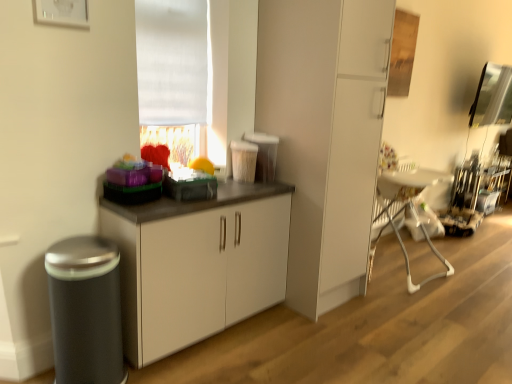
What do you see at coordinates (174, 76) in the screenshot? I see `white fabric window at upper center` at bounding box center [174, 76].

The height and width of the screenshot is (384, 512). In order to click on white plastic swivel chair at right in this screenshot , I will do `click(409, 209)`.

What do you see at coordinates (189, 185) in the screenshot? I see `matte black toaster at center, placed as the 2th appliance when sorted from front to back` at bounding box center [189, 185].

Describe the element at coordinates (464, 200) in the screenshot. I see `metallic stainless steel coffee machine at right, positioned as the 1th appliance in right-to-left order` at that location.

At what (x,y) coordinates should I click in order to perform the action: click on white fabric window at upper center. Please return your answer as a coordinate pair (x, y). Looking at the image, I should click on (174, 76).

Is white matte cabinet at center, which appears as the second cabinetry when viewed from the left, not inside transparent glass window screen at upper right?

Indeed, white matte cabinet at center, which appears as the second cabinetry when viewed from the left, is completely outside transparent glass window screen at upper right.

Is white matte cabinet at center, marked as the 1th cabinetry in a right-to-left arrangement, directly adjacent to transparent glass window screen at upper right?

No, white matte cabinet at center, marked as the 1th cabinetry in a right-to-left arrangement, is not touching transparent glass window screen at upper right.

What's the angular difference between white matte cabinet at center, marked as the 1th cabinetry in a right-to-left arrangement, and transparent glass window screen at upper right's facing directions?

white matte cabinet at center, marked as the 1th cabinetry in a right-to-left arrangement, and transparent glass window screen at upper right are facing 0.545 degrees away from each other.

Image resolution: width=512 pixels, height=384 pixels. I want to click on the 1st cabinetry in front of the transparent glass window screen at upper right, counting from the anchor's position, so point(325,135).

Consider the image. Based on their sizes in the image, would you say white matte cabinet at center, marked as the 1th cabinetry in a right-to-left arrangement, is bigger or smaller than white matte cabinet at center, which is the 1th cabinetry in left-to-right order?

white matte cabinet at center, marked as the 1th cabinetry in a right-to-left arrangement, is bigger than white matte cabinet at center, which is the 1th cabinetry in left-to-right order.

Does white matte cabinet at center, marked as the 1th cabinetry in a right-to-left arrangement, lie in front of white matte cabinet at center, which is the 1th cabinetry in left-to-right order?

No, the depth of white matte cabinet at center, marked as the 1th cabinetry in a right-to-left arrangement, is greater than that of white matte cabinet at center, which is the 1th cabinetry in left-to-right order.

Can you confirm if white matte cabinet at center, marked as the 1th cabinetry in a right-to-left arrangement, is taller than white matte cabinet at center, which is the 1th cabinetry in left-to-right order?

Correct, white matte cabinet at center, marked as the 1th cabinetry in a right-to-left arrangement, is much taller as white matte cabinet at center, which is the 1th cabinetry in left-to-right order.

Are white matte cabinet at center, which appears as the second cabinetry when viewed from the left, and white matte cabinet at center, which is the 2th cabinetry in right-to-left order, making contact?

They are not placed beside each other.

Can you tell me how much white fabric window at upper center and white plastic swivel chair at right differ in facing direction?

0.185 degrees separate the facing orientations of white fabric window at upper center and white plastic swivel chair at right.

Between point (158, 128) and point (410, 191), which one is positioned behind?

The point (410, 191) is more distant.

Would you say white fabric window at upper center is a long distance from white plastic swivel chair at right?

Yes, white fabric window at upper center and white plastic swivel chair at right are quite far apart.

Which is in front, point (453, 212) or point (385, 198)?

The point (385, 198) is more forward.

Which object is further away from the camera taking this photo, metallic stainless steel coffee machine at right, the first appliance viewed from the back, or white plastic swivel chair at right?

metallic stainless steel coffee machine at right, the first appliance viewed from the back.

In the scene shown: Which of these two, metallic stainless steel coffee machine at right, placed as the third appliance when sorted from front to back, or white plastic swivel chair at right, stands shorter?

metallic stainless steel coffee machine at right, placed as the third appliance when sorted from front to back.

From the image's perspective, is white plastic swivel chair at right located beneath metallic stainless steel coffee machine at right, positioned as the 1th appliance in right-to-left order?

Yes, from the image's perspective, white plastic swivel chair at right is beneath metallic stainless steel coffee machine at right, positioned as the 1th appliance in right-to-left order.

From a real-world perspective, who is located lower, white plastic swivel chair at right or metallic stainless steel coffee machine at right, positioned as the 1th appliance in right-to-left order?

metallic stainless steel coffee machine at right, positioned as the 1th appliance in right-to-left order, is physically lower.

Is white plastic swivel chair at right positioned behind metallic stainless steel coffee machine at right, positioned as the 1th appliance in right-to-left order?

No, white plastic swivel chair at right is in front of metallic stainless steel coffee machine at right, positioned as the 1th appliance in right-to-left order.

Based on the photo, is white plastic swivel chair at right smaller than metallic stainless steel coffee machine at right, positioned as the 1th appliance in right-to-left order?

Actually, white plastic swivel chair at right might be larger than metallic stainless steel coffee machine at right, positioned as the 1th appliance in right-to-left order.

From a real-world perspective, is matte black toaster at center, placed as the 2th appliance when sorted from front to back, physically located above or below metallic stainless steel coffee machine at right, placed as the third appliance when sorted from front to back?

matte black toaster at center, placed as the 2th appliance when sorted from front to back, is above metallic stainless steel coffee machine at right, placed as the third appliance when sorted from front to back.

Would you say matte black toaster at center, which appears as the 2th appliance when viewed from the left, is to the left or to the right of metallic stainless steel coffee machine at right, which ranks as the third appliance in left-to-right order, in the picture?

Clearly, matte black toaster at center, which appears as the 2th appliance when viewed from the left, is on the left of metallic stainless steel coffee machine at right, which ranks as the third appliance in left-to-right order, in the image.

How far apart are matte black toaster at center, which appears as the 2th appliance when viewed from the left, and metallic stainless steel coffee machine at right, positioned as the 1th appliance in right-to-left order?

The distance of matte black toaster at center, which appears as the 2th appliance when viewed from the left, from metallic stainless steel coffee machine at right, positioned as the 1th appliance in right-to-left order, is 3.06 meters.

Between matte black toaster at center, arranged as the 2th appliance when viewed from the back, and metallic stainless steel coffee machine at right, placed as the third appliance when sorted from front to back, which one has smaller width?

With smaller width is matte black toaster at center, arranged as the 2th appliance when viewed from the back.

Between point (455, 188) and point (268, 75), which one is positioned behind?

The point (455, 188) is farther from the camera.

In terms of height, does metallic stainless steel coffee machine at right, placed as the third appliance when sorted from front to back, look taller or shorter compared to white matte cabinet at center, marked as the 1th cabinetry in a right-to-left arrangement?

Considering their sizes, metallic stainless steel coffee machine at right, placed as the third appliance when sorted from front to back, has less height than white matte cabinet at center, marked as the 1th cabinetry in a right-to-left arrangement.

Is metallic stainless steel coffee machine at right, positioned as the 1th appliance in right-to-left order, looking in the opposite direction of white matte cabinet at center, which appears as the second cabinetry when viewed from the left?

metallic stainless steel coffee machine at right, positioned as the 1th appliance in right-to-left order, is not turned away from white matte cabinet at center, which appears as the second cabinetry when viewed from the left.

At what (x,y) coordinates should I click in order to perform the action: click on cabinetry that is the 1st object to the left of the transparent glass window screen at upper right, starting at the anchor. Please return your answer as a coordinate pair (x, y). Looking at the image, I should click on (325, 135).

You are a GUI agent. You are given a task and a screenshot of the screen. Output one action in this format:
    pyautogui.click(x=<x>, y=<y>)
    Task: Click on the cabinetry lying in front of the white matte cabinet at center, which appears as the second cabinetry when viewed from the left
    
    Given the screenshot: What is the action you would take?
    pyautogui.click(x=197, y=264)

Considering their positions, is transparent glass window screen at upper right positioned closer to matte black trash can at left, placed as the third appliance when sorted from right to left, than white matte cabinet at center, marked as the 1th cabinetry in a right-to-left arrangement?

white matte cabinet at center, marked as the 1th cabinetry in a right-to-left arrangement, is closer to matte black trash can at left, placed as the third appliance when sorted from right to left.

Estimate the real-world distances between objects in this image. Which object is closer to transparent glass window screen at upper right, white plastic swivel chair at right or metallic stainless steel coffee machine at right, positioned as the 1th appliance in right-to-left order?

Among the two, metallic stainless steel coffee machine at right, positioned as the 1th appliance in right-to-left order, is located nearer to transparent glass window screen at upper right.

Which object lies further to the anchor point metallic stainless steel coffee machine at right, the first appliance viewed from the back, white matte cabinet at center, which is the 1th cabinetry in left-to-right order, or white fabric window at upper center?

Among the two, white fabric window at upper center is located further to metallic stainless steel coffee machine at right, the first appliance viewed from the back.

Considering their positions, is matte black trash can at left, the third appliance from the back, positioned closer to matte black toaster at center, arranged as the 2th appliance when viewed from the back, than white matte cabinet at center, marked as the 1th cabinetry in a right-to-left arrangement?

matte black trash can at left, the third appliance from the back, lies closer to matte black toaster at center, arranged as the 2th appliance when viewed from the back, than the other object.

Consider the image. Looking at the image, which one is located further to white plastic swivel chair at right, white fabric window at upper center or metallic stainless steel coffee machine at right, placed as the third appliance when sorted from front to back?

The object further to white plastic swivel chair at right is white fabric window at upper center.

Based on their spatial positions, is matte black toaster at center, arranged as the 2th appliance when viewed from the back, or transparent glass window screen at upper right closer to white fabric window at upper center?

matte black toaster at center, arranged as the 2th appliance when viewed from the back, is positioned closer to the anchor white fabric window at upper center.

Considering their positions, is white matte cabinet at center, which is the 1th cabinetry in left-to-right order, positioned further to metallic stainless steel coffee machine at right, the first appliance viewed from the back, than matte black trash can at left, the first appliance positioned from the front?

matte black trash can at left, the first appliance positioned from the front, is positioned further to the anchor metallic stainless steel coffee machine at right, the first appliance viewed from the back.

From the image, which object appears to be farther from matte black toaster at center, placed as the 2th appliance when sorted from front to back, matte black trash can at left, the first appliance positioned from the front, or white fabric window at upper center?

matte black trash can at left, the first appliance positioned from the front, is positioned further to the anchor matte black toaster at center, placed as the 2th appliance when sorted from front to back.

This screenshot has height=384, width=512. Identify the location of cabinetry between matte black trash can at left, placed as the third appliance when sorted from right to left, and white matte cabinet at center, marked as the 1th cabinetry in a right-to-left arrangement, from left to right. (197, 264).

At what (x,y) coordinates should I click in order to perform the action: click on appliance located between matte black trash can at left, the first appliance positioned from the front, and metallic stainless steel coffee machine at right, which ranks as the third appliance in left-to-right order, in the left-right direction. Please return your answer as a coordinate pair (x, y). Looking at the image, I should click on (189, 185).

Locate an element on the screen. cabinetry between matte black toaster at center, arranged as the 2th appliance when viewed from the back, and matte black trash can at left, which is the first appliance from left to right, from top to bottom is located at coordinates (197, 264).

The width and height of the screenshot is (512, 384). Find the location of `window between matte black trash can at left, the first appliance positioned from the front, and white matte cabinet at center, marked as the 1th cabinetry in a right-to-left arrangement, in the horizontal direction`. window between matte black trash can at left, the first appliance positioned from the front, and white matte cabinet at center, marked as the 1th cabinetry in a right-to-left arrangement, in the horizontal direction is located at coordinates (174, 76).